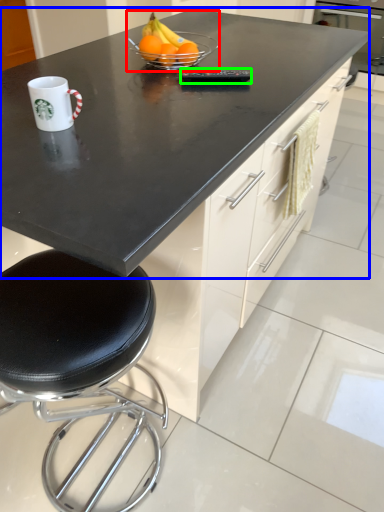
Question: Which is farther away from fruit dish (highlighted by a red box)? countertop (highlighted by a blue box) or appliance (highlighted by a green box)?

Choices:
 (A) countertop
 (B) appliance

Answer: (A)